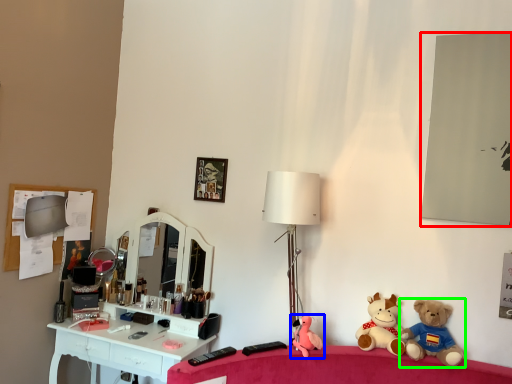
Question: Which object is positioned farthest from mirror (highlighted by a red box)? Select from toy (highlighted by a blue box) and toy (highlighted by a green box).

Choices:
 (A) toy
 (B) toy

Answer: (A)